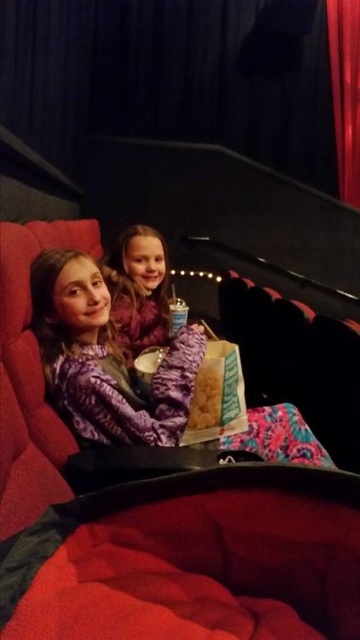
Who is more distant from viewer, (69,369) or (351,195)?

The point (351,195) is behind.

Which is above, purple patterned sweater at center or velvet red curtain at right?

velvet red curtain at right is higher up.

Is point (38, 266) closer to viewer compared to point (348, 67)?

Yes, point (38, 266) is in front of point (348, 67).

At what (x,y) coordinates should I click in order to perform the action: click on purple patterned sweater at center. Please return your answer as a coordinate pair (x, y). Looking at the image, I should click on (105, 358).

Can you confirm if dark blue velvet curtain at upper center is positioned above velvet red curtain at right?

Indeed, dark blue velvet curtain at upper center is positioned over velvet red curtain at right.

Does dark blue velvet curtain at upper center have a smaller size compared to velvet red curtain at right?

Actually, dark blue velvet curtain at upper center might be larger than velvet red curtain at right.

Identify the location of dark blue velvet curtain at upper center. Image resolution: width=360 pixels, height=640 pixels. 173,77.

Is matte purple dress at center behind velvet red curtain at right?

No.

Find the location of a particular element. Image resolution: width=360 pixels, height=640 pixels. matte purple dress at center is located at coordinates (137, 289).